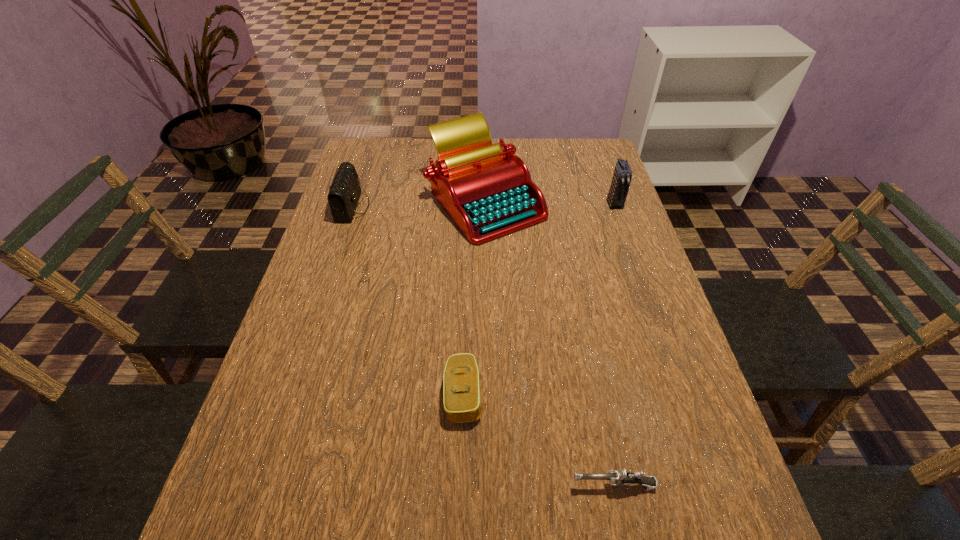
I want to click on free space between the typewriter and the fourth farthest object, so click(474, 298).

Where is `free space between the typewriter and the gun`? free space between the typewriter and the gun is located at coordinates (549, 343).

I want to click on unoccupied area between the second nearest object and the fourth shortest object, so click(x=539, y=299).

At what (x,y) coordinates should I click in order to perform the action: click on the third closest object to the second nearest object. Please return your answer as a coordinate pair (x, y). Image resolution: width=960 pixels, height=540 pixels. Looking at the image, I should click on (344, 192).

You are a GUI agent. You are given a task and a screenshot of the screen. Output one action in this format:
    pyautogui.click(x=<x>, y=<y>)
    Task: Click on the object that stands as the closest to the leftmost clutch bag
    The image size is (960, 540).
    Given the screenshot: What is the action you would take?
    pyautogui.click(x=487, y=190)

This screenshot has height=540, width=960. I want to click on clutch bag that is the nearest to the rightmost object, so click(462, 401).

At what (x,y) coordinates should I click in order to perform the action: click on the closest clutch bag to the tallest object. Please return your answer as a coordinate pair (x, y). Image resolution: width=960 pixels, height=540 pixels. Looking at the image, I should click on (344, 192).

This screenshot has width=960, height=540. I want to click on free space that satisfies the following two spatial constraints: 1. with the zip open on the rightmost clutch bag; 2. on the zipper side of the second clutch bag from right to left, so click(682, 395).

Image resolution: width=960 pixels, height=540 pixels. I want to click on free space that satisfies the following two spatial constraints: 1. with the zip open on the rightmost clutch bag; 2. on the front flap of the third shortest object, so click(x=615, y=207).

The width and height of the screenshot is (960, 540). I want to click on vacant space that satisfies the following two spatial constraints: 1. on the typing side of the typewriter; 2. on the zipper side of the second nearest object, so click(489, 395).